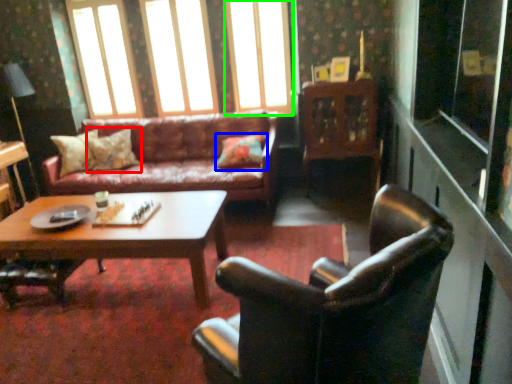
Question: Estimate the real-world distances between objects in this image. Which object is farther from pillow (highlighted by a red box), pillow (highlighted by a blue box) or window (highlighted by a green box)?

Choices:
 (A) pillow
 (B) window

Answer: (B)